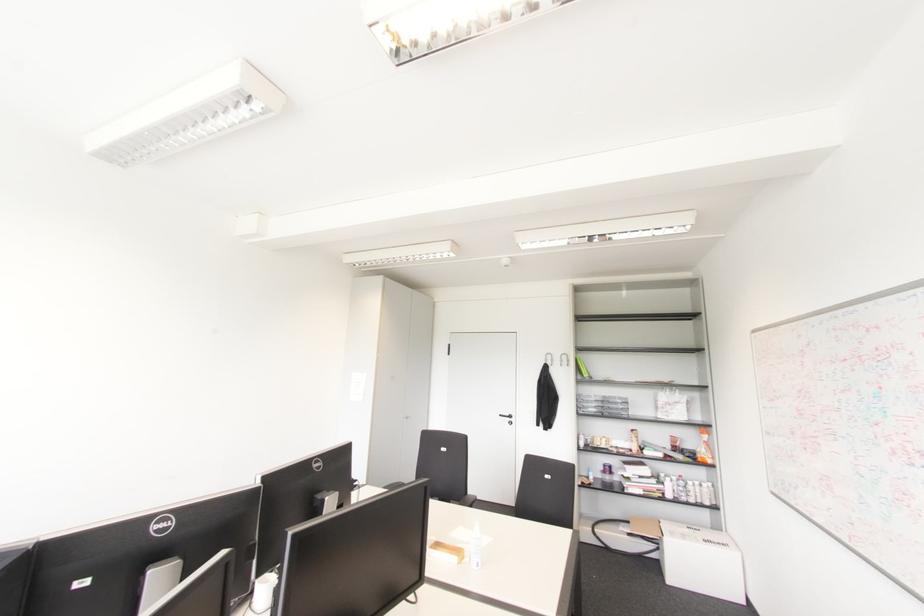
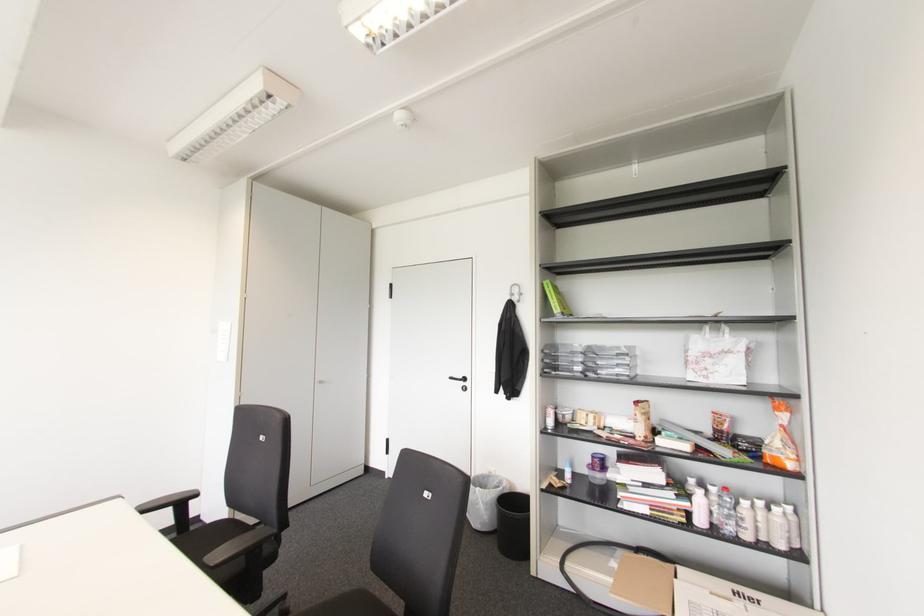
The point at (667, 495) is marked in the first image. Where is the corresponding point in the second image?

(699, 521)